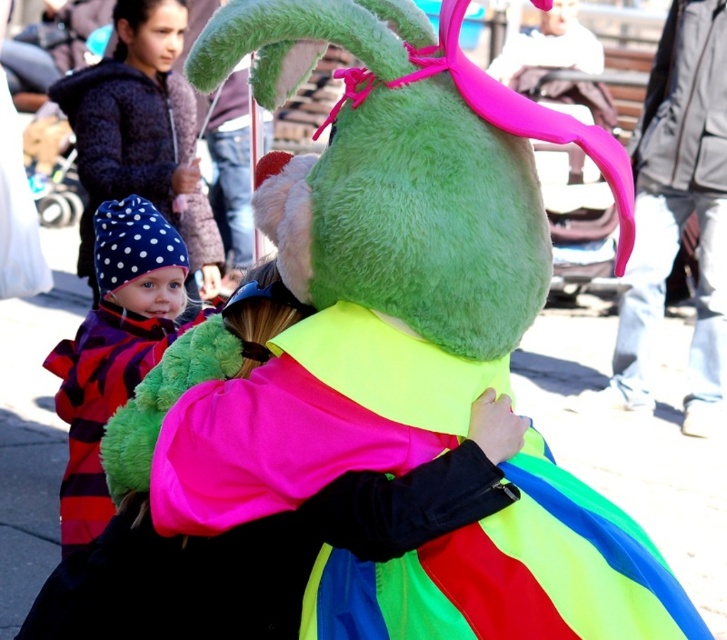
From the picture: Does polka dot fabric hat at lower left appear on the left side of polka dot fabric hat at left?

Yes, polka dot fabric hat at lower left is to the left of polka dot fabric hat at left.

Is polka dot fabric hat at lower left below polka dot fabric hat at left?

Actually, polka dot fabric hat at lower left is above polka dot fabric hat at left.

Does point (136, 19) come in front of point (103, 516)?

No.

Find the location of a particular element. polka dot fabric hat at lower left is located at coordinates (140, 134).